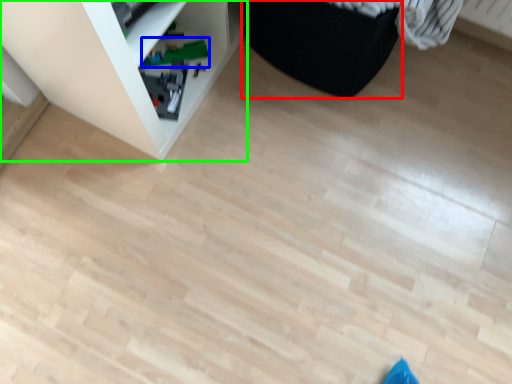
Question: Considering the real-world distances, which object is closest to furniture (highlighted by a red box)? toy (highlighted by a blue box) or shelf (highlighted by a green box).

Choices:
 (A) toy
 (B) shelf

Answer: (B)